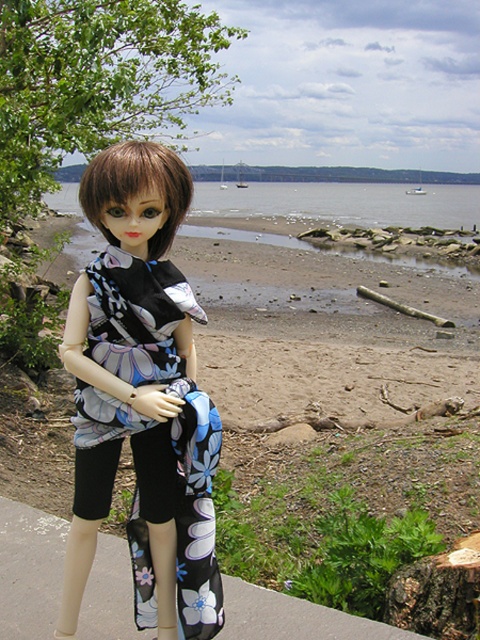
Question: Does clear water at beach center appear under brown wood stump at lower right?

Choices:
 (A) yes
 (B) no

Answer: (B)

Question: Among these points, which one is farthest from the camera?

Choices:
 (A) (167, 532)
 (B) (408, 208)
 (C) (386, 596)
 (D) (289, 618)

Answer: (B)

Question: Which object is the farthest from the floral-patterned fabric dress at center?

Choices:
 (A) clear water at beach center
 (B) brown wood stump at lower right

Answer: (A)

Question: Which of these objects is positioned farthest from the floral-patterned fabric dress at center?

Choices:
 (A) brown wood stump at lower right
 (B) smooth concrete ledge at lower left
 (C) clear water at beach center

Answer: (C)

Question: Can you confirm if floral-patterned fabric dress at center is positioned above brown wood stump at lower right?

Choices:
 (A) no
 (B) yes

Answer: (B)

Question: In this image, where is floral-patterned fabric dress at center located relative to smooth concrete ledge at lower left?

Choices:
 (A) right
 (B) left

Answer: (A)